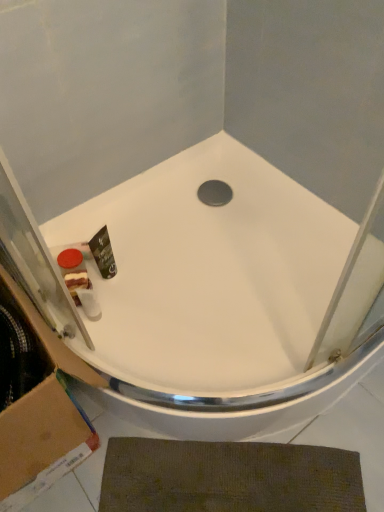
This screenshot has height=512, width=384. What do you see at coordinates (223, 297) in the screenshot?
I see `white glossy bathtub at center` at bounding box center [223, 297].

Where is `matte plastic soap at lower left`? The width and height of the screenshot is (384, 512). matte plastic soap at lower left is located at coordinates (73, 272).

From the image's perspective, between brown cardboard at lower left and matte plastic soap at lower left, which one is located above?

matte plastic soap at lower left.

This screenshot has width=384, height=512. In order to click on toiletry located behind the brown cardboard at lower left in this screenshot , I will do `click(73, 272)`.

In terms of height, does brown cardboard at lower left look taller or shorter compared to matte plastic soap at lower left?

brown cardboard at lower left is taller than matte plastic soap at lower left.

Does brown cardboard at lower left have a smaller size compared to matte plastic soap at lower left?

Incorrect, brown cardboard at lower left is not smaller in size than matte plastic soap at lower left.

Consider the image. In terms of size, does white glossy bathtub at center appear bigger or smaller than brown textured bath mat at lower center?

Clearly, white glossy bathtub at center is larger in size than brown textured bath mat at lower center.

Considering the sizes of objects white glossy bathtub at center and brown textured bath mat at lower center in the image provided, who is wider, white glossy bathtub at center or brown textured bath mat at lower center?

Wider between the two is white glossy bathtub at center.

Are white glossy bathtub at center and brown textured bath mat at lower center far apart?

Actually, white glossy bathtub at center and brown textured bath mat at lower center are a little close together.

Is white glossy bathtub at center looking in the opposite direction of brown cardboard at lower left?

No, white glossy bathtub at center is not facing away from brown cardboard at lower left.

Looking at this image, between white glossy bathtub at center and brown cardboard at lower left, which one appears on the left side from the viewer's perspective?

brown cardboard at lower left.

Considering the sizes of objects white glossy bathtub at center and brown cardboard at lower left in the image provided, who is shorter, white glossy bathtub at center or brown cardboard at lower left?

white glossy bathtub at center is shorter.

Can you confirm if brown textured bath mat at lower center is taller than white glossy bathtub at center?

In fact, brown textured bath mat at lower center may be shorter than white glossy bathtub at center.

Is brown textured bath mat at lower center looking in the opposite direction of white glossy bathtub at center?

Absolutely, brown textured bath mat at lower center is directed away from white glossy bathtub at center.

Is brown textured bath mat at lower center next to white glossy bathtub at center?

No, brown textured bath mat at lower center is not next to white glossy bathtub at center.

Is brown textured bath mat at lower center inside or outside of white glossy bathtub at center?

brown textured bath mat at lower center is located beyond the bounds of white glossy bathtub at center.

Is white glossy bathtub at center at the back of matte plastic soap at lower left?

Yes.

Does point (78, 287) come closer to viewer compared to point (233, 206)?

That is True.

Locate an element on the screen. This screenshot has height=512, width=384. toiletry on the left of white glossy bathtub at center is located at coordinates (73, 272).

This screenshot has height=512, width=384. Identify the location of cardboard box positioned vertically above the matte plastic soap at lower left (from a real-world perspective). (36, 402).

From a real-world perspective, which is physically below, matte plastic soap at lower left or brown cardboard at lower left?

matte plastic soap at lower left, from a real-world perspective.

Considering the relative sizes of matte plastic soap at lower left and brown cardboard at lower left in the image provided, is matte plastic soap at lower left bigger than brown cardboard at lower left?

Incorrect, matte plastic soap at lower left is not larger than brown cardboard at lower left.

Which is correct: brown cardboard at lower left is inside white glossy bathtub at center, or outside of it?

brown cardboard at lower left lies outside white glossy bathtub at center.

Considering the relative sizes of brown cardboard at lower left and white glossy bathtub at center in the image provided, is brown cardboard at lower left shorter than white glossy bathtub at center?

No.

From the picture: Between brown cardboard at lower left and white glossy bathtub at center, which one is positioned behind?

Positioned behind is white glossy bathtub at center.

Measure the distance from brown cardboard at lower left to white glossy bathtub at center.

The distance of brown cardboard at lower left from white glossy bathtub at center is 39.56 centimeters.

Locate an element on the screen. This screenshot has height=512, width=384. cardboard box below the matte plastic soap at lower left (from the image's perspective) is located at coordinates pyautogui.click(x=36, y=402).

I want to click on bathtub on the left of the brown textured bath mat at lower center, so click(223, 297).

Which object lies further to the anchor point brown cardboard at lower left, white glossy bathtub at center or brown textured bath mat at lower center?

Based on the image, white glossy bathtub at center appears to be further to brown cardboard at lower left.

Estimate the real-world distances between objects in this image. Which object is closer to matte plastic soap at lower left, brown cardboard at lower left or white glossy bathtub at center?

brown cardboard at lower left is positioned closer to the anchor matte plastic soap at lower left.

Considering their positions, is brown textured bath mat at lower center positioned closer to brown cardboard at lower left than matte plastic soap at lower left?

brown textured bath mat at lower center is positioned closer to the anchor brown cardboard at lower left.

Based on their spatial positions, is matte plastic soap at lower left or white glossy bathtub at center closer to brown textured bath mat at lower center?

white glossy bathtub at center is closer to brown textured bath mat at lower center.

From the image, which object appears to be nearer to brown textured bath mat at lower center, brown cardboard at lower left or white glossy bathtub at center?

Based on the image, brown cardboard at lower left appears to be nearer to brown textured bath mat at lower center.

Consider the image. Looking at the image, which one is located closer to white glossy bathtub at center, brown textured bath mat at lower center or matte plastic soap at lower left?

Among the two, brown textured bath mat at lower center is located nearer to white glossy bathtub at center.

Considering their positions, is matte plastic soap at lower left positioned further to brown cardboard at lower left than brown textured bath mat at lower center?

Based on the image, matte plastic soap at lower left appears to be further to brown cardboard at lower left.

Which object lies nearer to the anchor point matte plastic soap at lower left, brown textured bath mat at lower center or brown cardboard at lower left?

Based on the image, brown cardboard at lower left appears to be nearer to matte plastic soap at lower left.

What are the coordinates of `toiletry located between brown cardboard at lower left and white glossy bathtub at center in the left-right direction` in the screenshot? It's located at (73, 272).

Find the location of `bathtub between brown cardboard at lower left and brown textured bath mat at lower center from left to right`. bathtub between brown cardboard at lower left and brown textured bath mat at lower center from left to right is located at coordinates (223, 297).

This screenshot has height=512, width=384. Identify the location of toiletry between brown cardboard at lower left and brown textured bath mat at lower center from left to right. (73, 272).

At what (x,y) coordinates should I click in order to perform the action: click on bathtub between matte plastic soap at lower left and brown textured bath mat at lower center in the vertical direction. Please return your answer as a coordinate pair (x, y). This screenshot has width=384, height=512. Looking at the image, I should click on (223, 297).